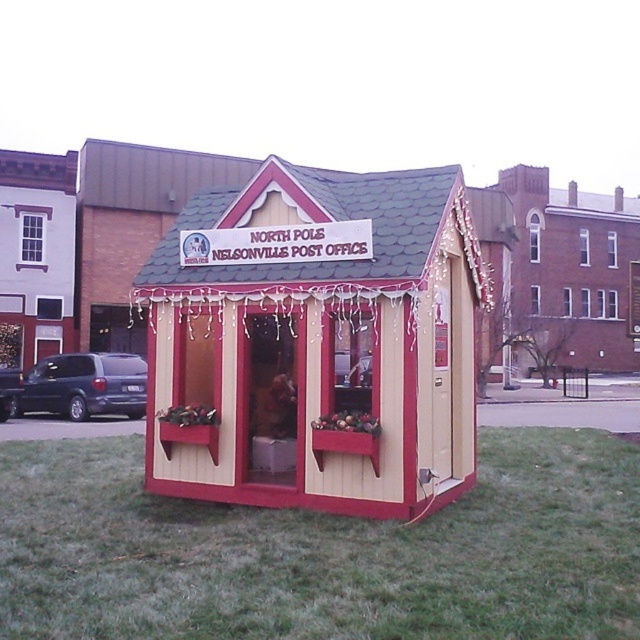
Question: Estimate the real-world distances between objects in this image. Which object is farther from the matte white building at upper left?

Choices:
 (A) dark blue matte van at left
 (B) brick building at center
 (C) wooden cabin at center
 (D) matte dark blue van at left

Answer: (B)

Question: Considering the relative positions of brick building at center and dark blue matte van at left in the image provided, where is brick building at center located with respect to dark blue matte van at left?

Choices:
 (A) right
 (B) left

Answer: (A)

Question: Which object appears farthest from the camera in this image?

Choices:
 (A) brick building at center
 (B) matte white building at upper left
 (C) matte dark blue van at left

Answer: (A)

Question: Is wooden cabin at center wider than matte white building at upper left?

Choices:
 (A) no
 (B) yes

Answer: (A)

Question: Which object is the farthest from the dark blue matte van at left?

Choices:
 (A) brick building at center
 (B) matte dark blue van at left
 (C) wooden cabin at center
 (D) matte white building at upper left

Answer: (A)

Question: Does wooden cabin at center have a smaller size compared to dark blue matte van at left?

Choices:
 (A) no
 (B) yes

Answer: (B)